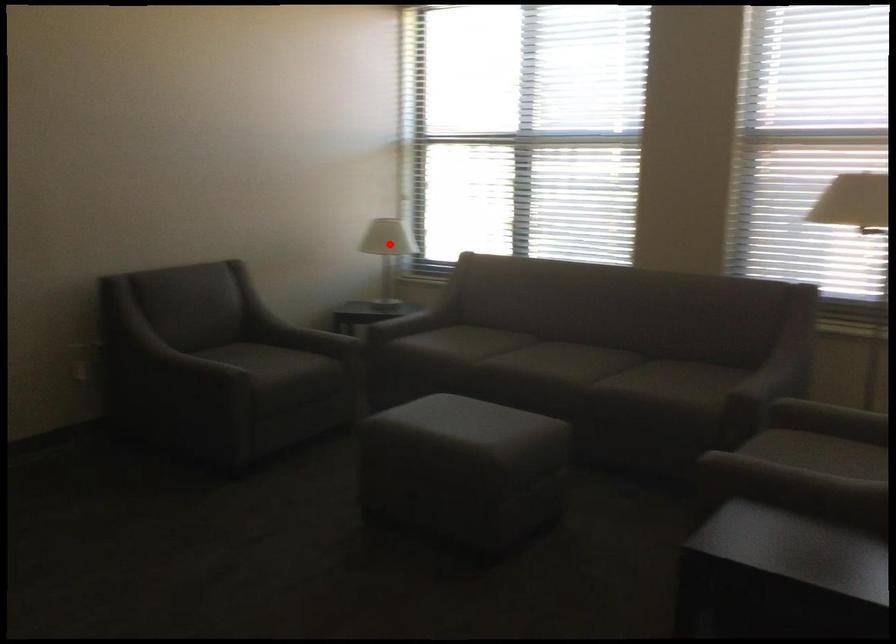
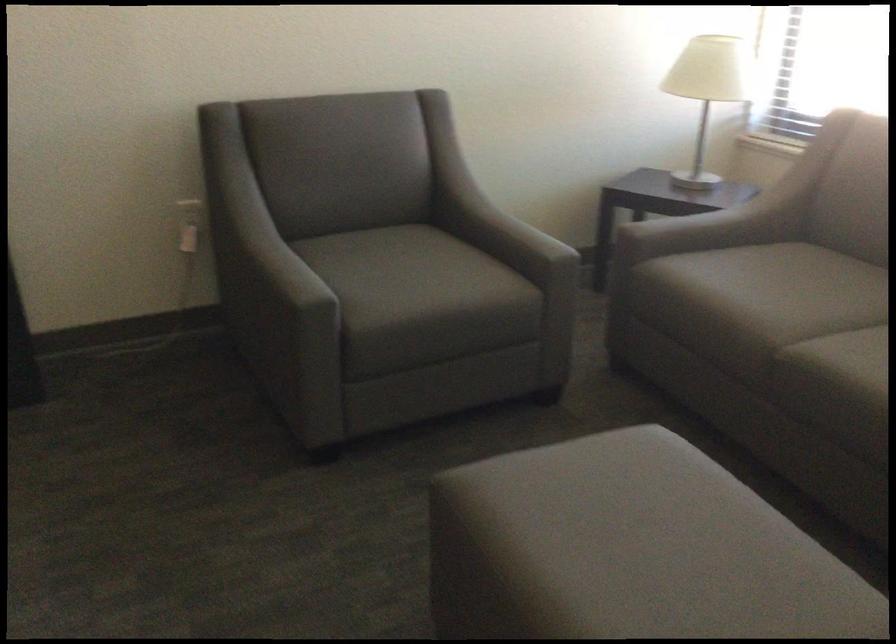
Locate, in the second image, the point that corresponds to the highlighted location in the first image.

(708, 90)